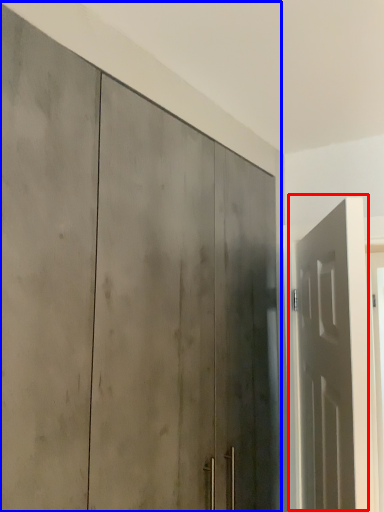
Question: Which of the following is the farthest to the observer, door (highlighted by a red box) or door (highlighted by a blue box)?

Choices:
 (A) door
 (B) door

Answer: (A)